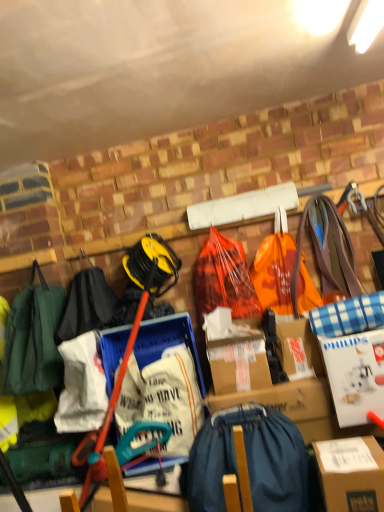
Question: In terms of height, does orange plastic grocery bag at center, the 1th grocery bag in the right-to-left sequence, look taller or shorter compared to brown cardboard box at lower right?

Choices:
 (A) tall
 (B) short

Answer: (A)

Question: From the image's perspective, is orange plastic grocery bag at center, placed as the second grocery bag when sorted from left to right, located above or below brown cardboard box at lower right?

Choices:
 (A) above
 (B) below

Answer: (A)

Question: Which object is positioned farthest from the white cardboard box at right?

Choices:
 (A) brown cardboard box at lower right
 (B) orange plastic bag at center, marked as the 1th grocery bag in a left-to-right arrangement
 (C) denim backpack at center
 (D) orange plastic grocery bag at center, placed as the second grocery bag when sorted from left to right

Answer: (B)

Question: Estimate the real-world distances between objects in this image. Which object is closer to the white cardboard box at right?

Choices:
 (A) orange plastic grocery bag at center, the 1th grocery bag in the right-to-left sequence
 (B) orange plastic bag at center, the 2th grocery bag when ordered from right to left
 (C) brown cardboard box at lower right
 (D) denim backpack at center

Answer: (C)